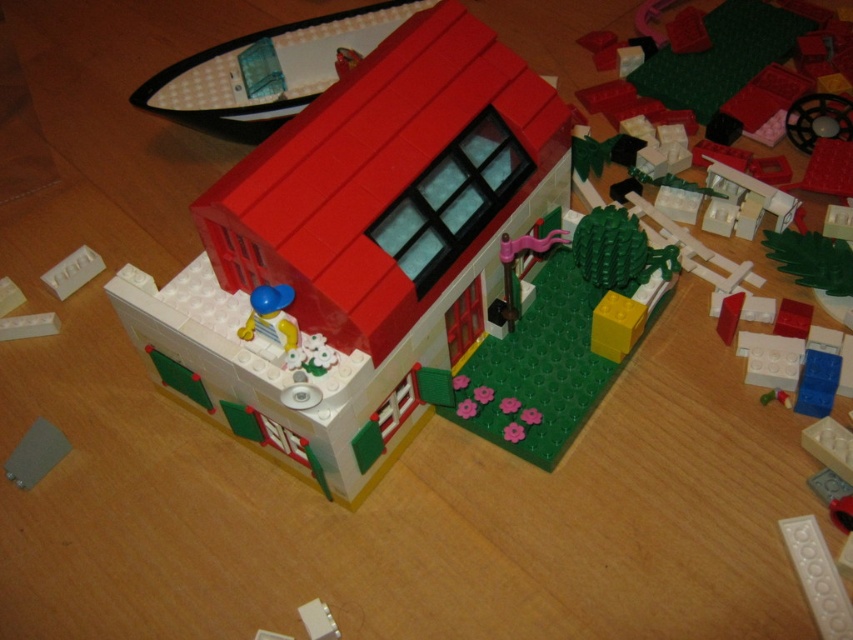
Question: Which point is closer to the camera?

Choices:
 (A) (61, 292)
 (B) (38, 476)

Answer: (B)

Question: Does smooth plastic house at center appear under smooth gray plate at lower left?

Choices:
 (A) yes
 (B) no

Answer: (B)

Question: Does smooth plastic house at center have a larger size compared to white matte brick at center?

Choices:
 (A) yes
 (B) no

Answer: (A)

Question: Can you confirm if smooth gray plate at lower left is positioned to the left of white matte brick at center?

Choices:
 (A) yes
 (B) no

Answer: (B)

Question: Which object is closer to the camera taking this photo?

Choices:
 (A) smooth plastic house at center
 (B) smooth gray plate at lower left
 (C) white matte brick at center

Answer: (A)

Question: Which point is closer to the camera taking this photo?

Choices:
 (A) (335, 278)
 (B) (82, 244)
 (C) (36, 442)

Answer: (A)